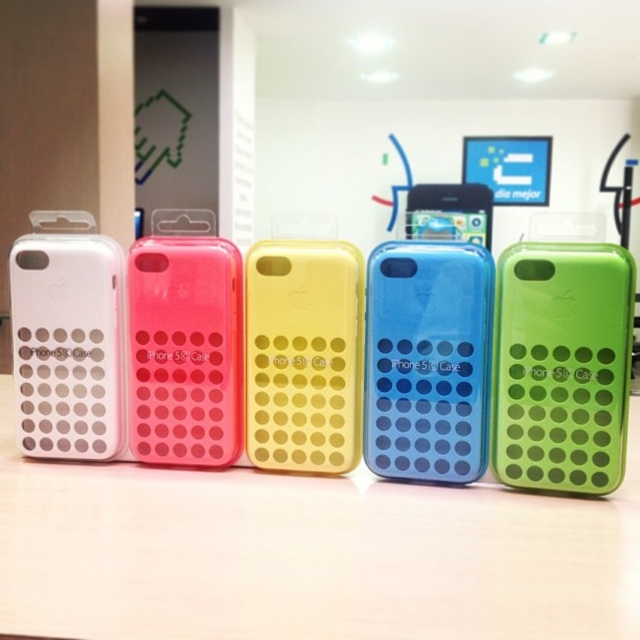
Is yellow matte iphone case at center positioned behind blue translucent phone case at center?

No, it is in front of blue translucent phone case at center.

In the scene shown: Can you confirm if yellow matte iphone case at center is smaller than blue translucent phone case at center?

Indeed, yellow matte iphone case at center has a smaller size compared to blue translucent phone case at center.

Between point (324, 289) and point (465, 209), which one is positioned behind?

The point (465, 209) is behind.

Identify the location of yellow matte iphone case at center. (304, 355).

How distant is white matte iphone case at center from matte white phone case at left?

white matte iphone case at center is 9.70 inches from matte white phone case at left.

Which of these two, white matte iphone case at center or matte white phone case at left, stands shorter?

white matte iphone case at center is shorter.

Which is behind, point (387, 545) or point (93, 248)?

Point (93, 248)

At what (x,y) coordinates should I click in order to perform the action: click on white matte iphone case at center. Please return your answer as a coordinate pair (x, y). The height and width of the screenshot is (640, 640). Looking at the image, I should click on (305, 554).

Who is lower down, white matte iphone case at center or blue translucent phone case at center?

white matte iphone case at center is below.

The width and height of the screenshot is (640, 640). In order to click on white matte iphone case at center in this screenshot , I will do `click(305, 554)`.

Describe the element at coordinates (305, 554) in the screenshot. I see `white matte iphone case at center` at that location.

The width and height of the screenshot is (640, 640). I want to click on white matte iphone case at center, so click(x=305, y=554).